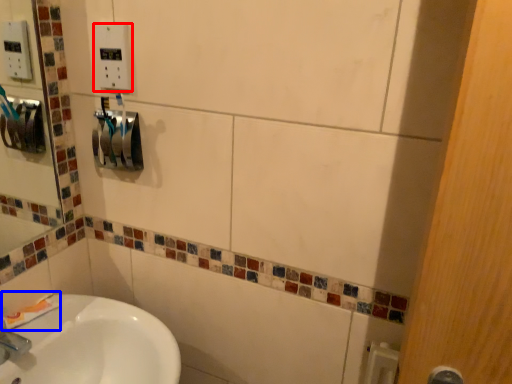
Question: Which object is further to the camera taking this photo, electric outlet (highlighted by a red box) or toothpaste (highlighted by a blue box)?

Choices:
 (A) electric outlet
 (B) toothpaste

Answer: (B)